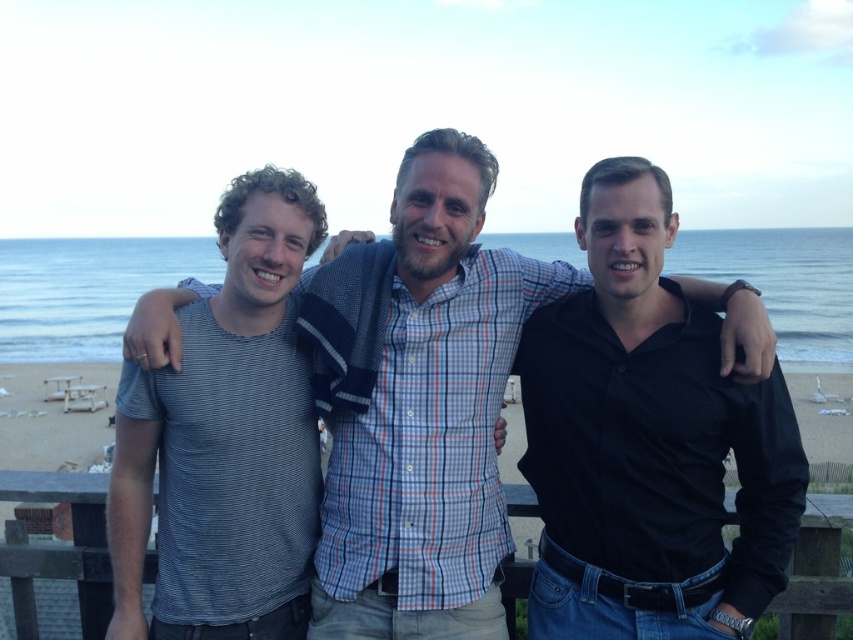
You are standing at the edge of the beach, looking towards three men near a wooden railing. The striped cotton shirt at center is part of their clothing. If you want to wave to them, will your hand signal be visible to them? Assume your arm can extend 1.5 meters.

The striped cotton shirt at center and viewer are 6.12 meters apart. Since your arm can extend 1.5 meters, the total distance you can reach is 1.5 meters. The distance between you and the striped cotton shirt at center is 6.12 meters, which is farther than your reach. Therefore, your hand signal may not be visible to them unless they have excellent eyesight.